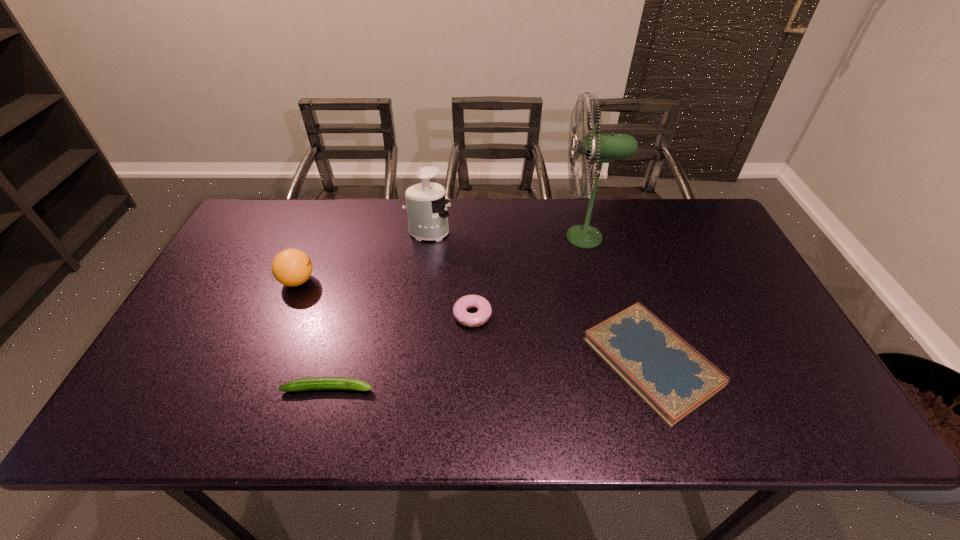
Locate an element on the screen. This screenshot has width=960, height=540. free space between the paperback book and the fan is located at coordinates (618, 299).

Find the location of a particular element. unoccupied area between the third object from right to left and the paperback book is located at coordinates (562, 338).

Identify the location of vacant area that lies between the tallest object and the doughnut. (529, 275).

Where is `empty space that is in between the juicer and the fourth object from left to right`? This screenshot has height=540, width=960. empty space that is in between the juicer and the fourth object from left to right is located at coordinates (450, 274).

Select which object appears as the closest to the third tallest object. Please provide its 2D coordinates. Your answer should be formatted as a tuple, i.e. [(x, y)], where the tuple contains the x and y coordinates of a point satisfying the conditions above.

[(427, 213)]

I want to click on the second closest object to the fourth object from right to left, so click(291, 267).

Find the location of a particular element. This screenshot has height=540, width=960. free space that satisfies the following two spatial constraints: 1. on the front side of the fourth object from right to left; 2. on the front-facing side of the zucchini is located at coordinates (409, 388).

The width and height of the screenshot is (960, 540). Find the location of `blank space that satisfies the following two spatial constraints: 1. on the side with brand of the ping-pong ball; 2. on the back side of the paperback book`. blank space that satisfies the following two spatial constraints: 1. on the side with brand of the ping-pong ball; 2. on the back side of the paperback book is located at coordinates (265, 361).

Find the location of a particular element. vacant position in the image that satisfies the following two spatial constraints: 1. on the front-facing side of the paperback book; 2. on the left side of the tallest object is located at coordinates (618, 361).

Where is `blank space that satisfies the following two spatial constraints: 1. on the front-facing side of the tallest object; 2. on the front side of the doughnut`? The width and height of the screenshot is (960, 540). blank space that satisfies the following two spatial constraints: 1. on the front-facing side of the tallest object; 2. on the front side of the doughnut is located at coordinates (606, 314).